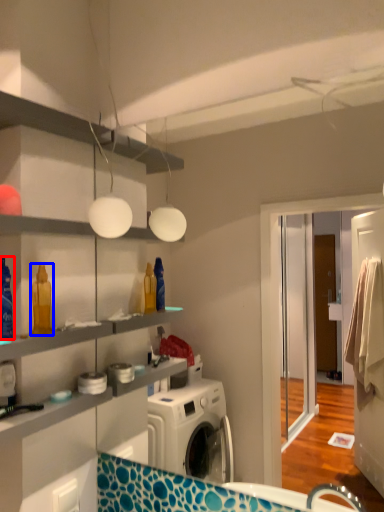
Question: Which object is further to the camera taking this photo, cleaning product (highlighted by a red box) or cleaning product (highlighted by a blue box)?

Choices:
 (A) cleaning product
 (B) cleaning product

Answer: (B)